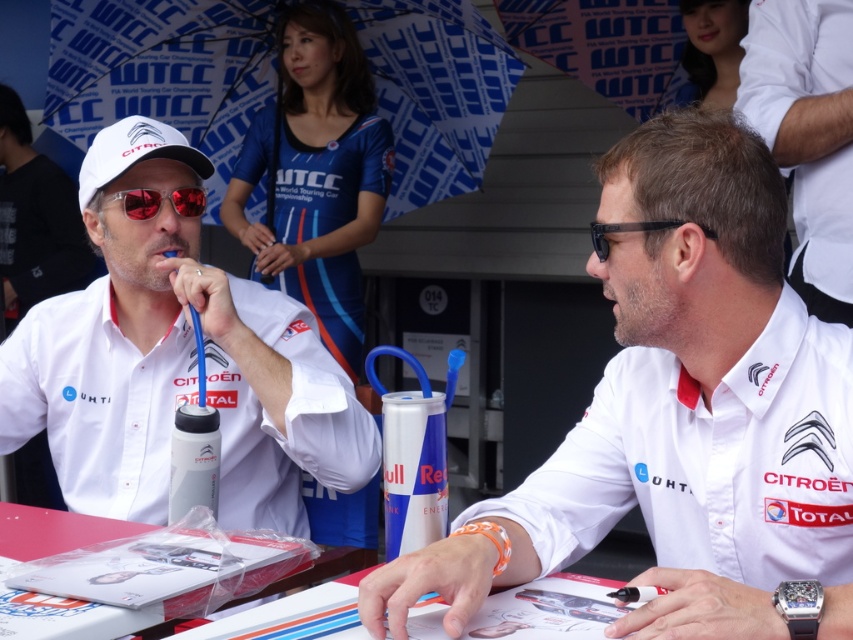
You are a photographer positioned at the center of the image. You want to take a photo of the white matte baseball cap at upper left. What are the coordinates of the cap relative to your position?

The white matte baseball cap at upper left is located at coordinates 0.239 in the x direction and 0.157 in the y direction.

You are standing at the motorsport event and looking at the Citroen Total team members. There are two points marked in the image. The first point is at coordinate (828,308) and the second point is at coordinate (167,131). Which point is closer to you?

Point (167,131) is closer to you because it is less further away than point (828,308).